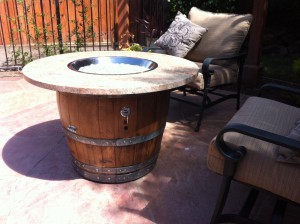
Locate an element on the screen. Image resolution: width=300 pixels, height=224 pixels. cushion is located at coordinates (268, 121), (199, 62).